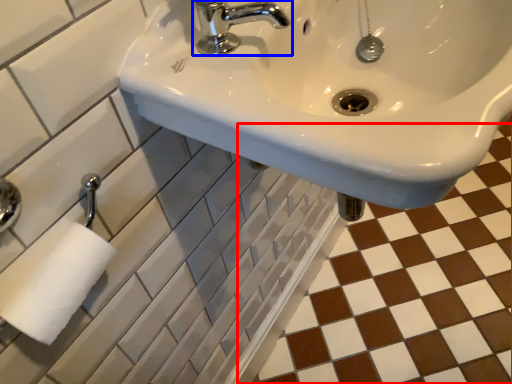
Question: Which point is further to the camera, ceramic tile (highlighted by a red box) or tap (highlighted by a blue box)?

Choices:
 (A) ceramic tile
 (B) tap

Answer: (A)